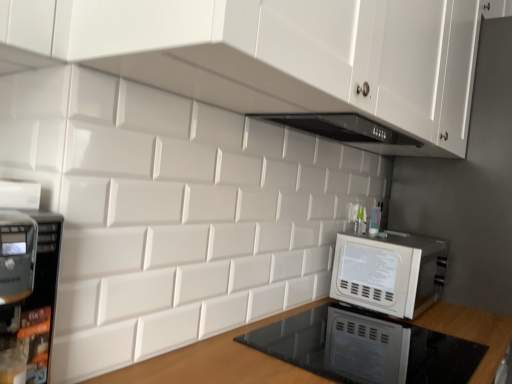
Question: Does wooden at lower center lie behind white glossy cabinet at upper center?

Choices:
 (A) yes
 (B) no

Answer: (B)

Question: Can you confirm if wooden at lower center is positioned to the left of white glossy cabinet at upper center?

Choices:
 (A) yes
 (B) no

Answer: (A)

Question: Is wooden at lower center smaller than white glossy cabinet at upper center?

Choices:
 (A) yes
 (B) no

Answer: (B)

Question: Is wooden at lower center looking in the opposite direction of white glossy cabinet at upper center?

Choices:
 (A) yes
 (B) no

Answer: (B)

Question: Considering the relative sizes of wooden at lower center and white glossy cabinet at upper center in the image provided, is wooden at lower center bigger than white glossy cabinet at upper center?

Choices:
 (A) no
 (B) yes

Answer: (B)

Question: Is wooden at lower center to the right of white glossy cabinet at upper center from the viewer's perspective?

Choices:
 (A) no
 (B) yes

Answer: (A)

Question: From the image's perspective, is white glossy cabinet at upper center on white glossy microwave at right?

Choices:
 (A) yes
 (B) no

Answer: (A)

Question: Is white glossy microwave at right inside white glossy cabinet at upper center?

Choices:
 (A) yes
 (B) no

Answer: (B)

Question: Can you confirm if white glossy cabinet at upper center is shorter than white glossy microwave at right?

Choices:
 (A) yes
 (B) no

Answer: (B)

Question: Would you consider white glossy cabinet at upper center to be distant from white glossy microwave at right?

Choices:
 (A) no
 (B) yes

Answer: (A)

Question: Is white glossy cabinet at upper center facing away from white glossy microwave at right?

Choices:
 (A) no
 (B) yes

Answer: (A)

Question: Can you confirm if white glossy cabinet at upper center is smaller than white glossy microwave at right?

Choices:
 (A) yes
 (B) no

Answer: (B)

Question: Is white glossy microwave at right not near wooden at lower center?

Choices:
 (A) no
 (B) yes

Answer: (A)